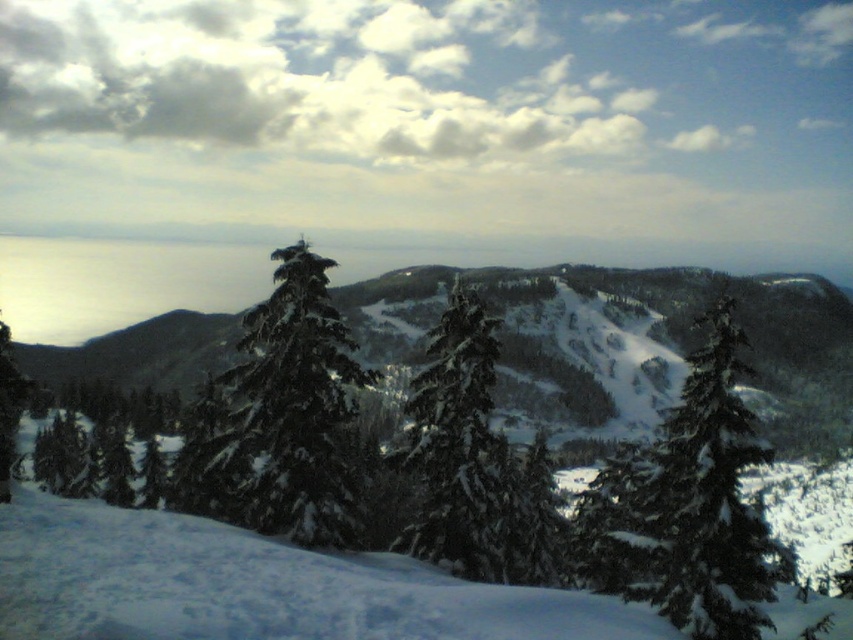
Which is more to the left, green matte tree at center or green matte evergreen tree at center?

green matte evergreen tree at center is more to the left.

Can you confirm if green matte tree at center is positioned to the left of green matte evergreen tree at center?

No, green matte tree at center is not to the left of green matte evergreen tree at center.

Between point (688, 634) and point (274, 376), which one is positioned behind?

The point (274, 376) is behind.

Where is `green matte tree at center`? green matte tree at center is located at coordinates (697, 502).